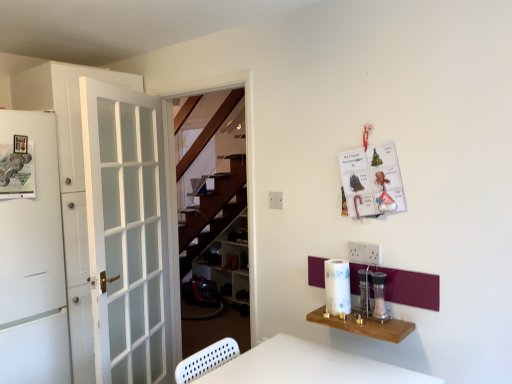
Question: Is metallic silver salt and pepper shakers at center right, which appears as the 2th appliance when viewed from the right, oriented towards white glass door at left, the 1th door in the back-to-front sequence?

Choices:
 (A) no
 (B) yes

Answer: (A)

Question: Can you confirm if metallic silver salt and pepper shakers at center right, which ranks as the 1th appliance in left-to-right order, is shorter than white glass door at left, the 1th door in the back-to-front sequence?

Choices:
 (A) yes
 (B) no

Answer: (A)

Question: Is metallic silver salt and pepper shakers at center right, which ranks as the 1th appliance in left-to-right order, facing away from white glass door at left, positioned as the 2th door in front-to-back order?

Choices:
 (A) no
 (B) yes

Answer: (A)

Question: From a real-world perspective, does metallic silver salt and pepper shakers at center right, which appears as the 2th appliance when viewed from the right, stand above white glass door at left, positioned as the 2th door in front-to-back order?

Choices:
 (A) no
 (B) yes

Answer: (A)

Question: From the image's perspective, is metallic silver salt and pepper shakers at center right, which ranks as the 1th appliance in left-to-right order, above white glass door at left, the 1th door in the back-to-front sequence?

Choices:
 (A) no
 (B) yes

Answer: (A)

Question: Is point (370, 284) positioned closer to the camera than point (373, 324)?

Choices:
 (A) closer
 (B) farther

Answer: (B)

Question: In the image, is metallic silver salt and pepper shakers at center right, which ranks as the 1th appliance in left-to-right order, positioned in front of or behind wooden shelf at lower right?

Choices:
 (A) behind
 (B) front

Answer: (A)

Question: In terms of width, does metallic silver salt and pepper shakers at center right, which ranks as the 1th appliance in left-to-right order, look wider or thinner when compared to wooden shelf at lower right?

Choices:
 (A) thin
 (B) wide

Answer: (A)

Question: From a real-world perspective, relative to wooden shelf at lower right, is metallic silver salt and pepper shakers at center right, which appears as the 2th appliance when viewed from the right, vertically above or below?

Choices:
 (A) below
 (B) above

Answer: (B)

Question: In the image, is wooden shelf at lower right on the left side or the right side of metallic silver salt and pepper shakers at center right, which appears as the 2th appliance when viewed from the right?

Choices:
 (A) left
 (B) right

Answer: (A)

Question: Would you say wooden shelf at lower right is inside or outside metallic silver salt and pepper shakers at center right, which ranks as the 1th appliance in left-to-right order?

Choices:
 (A) inside
 (B) outside

Answer: (B)

Question: Does point (364, 334) appear closer or farther from the camera than point (360, 283)?

Choices:
 (A) farther
 (B) closer

Answer: (B)

Question: From the image's perspective, is wooden shelf at lower right above or below metallic silver salt and pepper shakers at center right, which appears as the 2th appliance when viewed from the right?

Choices:
 (A) below
 (B) above

Answer: (A)

Question: Would you say wooden shelf at lower right is to the left or to the right of white matte refrigerator at left, the 2th door from the back, in the picture?

Choices:
 (A) right
 (B) left

Answer: (A)

Question: Is wooden shelf at lower right situated inside white matte refrigerator at left, placed as the 1th door when sorted from front to back, or outside?

Choices:
 (A) inside
 (B) outside

Answer: (B)